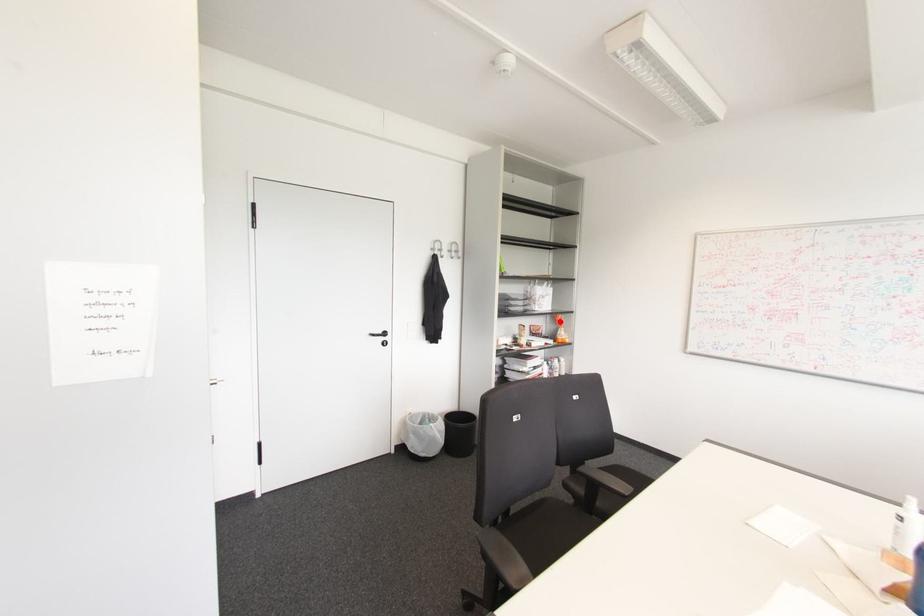
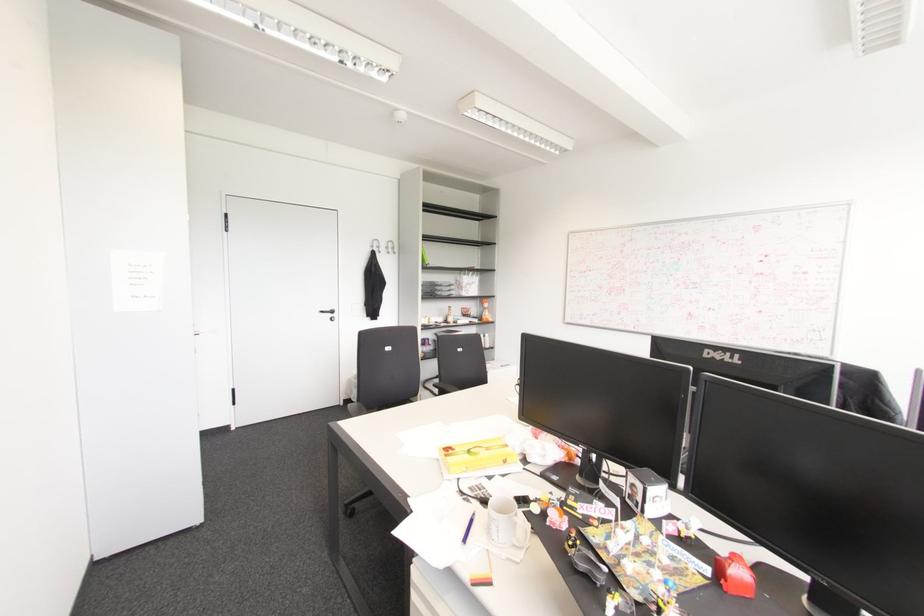
Where in the second image is the point corresponding to the highlighted location from the first image?

(485, 305)